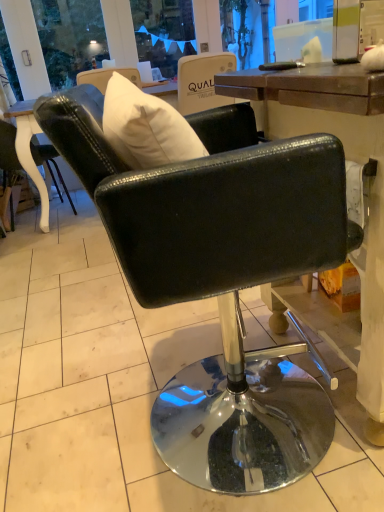
Question: From a real-world perspective, is glossy black chair at center, which ranks as the second chair in back-to-front order, physically located above or below black leather chair at left, placed as the 2th chair when sorted from right to left?

Choices:
 (A) below
 (B) above

Answer: (B)

Question: Which is correct: glossy black chair at center, the first chair from the right, is inside black leather chair at left, placed as the 2th chair when sorted from right to left, or outside of it?

Choices:
 (A) outside
 (B) inside

Answer: (A)

Question: Is glossy black chair at center, which is counted as the 2th chair, starting from the left, bigger or smaller than black leather chair at left, placed as the 1th chair when sorted from left to right?

Choices:
 (A) small
 (B) big

Answer: (B)

Question: Choose the correct answer: Is black leather chair at left, placed as the 2th chair when sorted from right to left, inside glossy black chair at center, the first chair from the right, or outside it?

Choices:
 (A) inside
 (B) outside

Answer: (B)

Question: Is black leather chair at left, which ranks as the 1th chair in back-to-front order, taller or shorter than glossy black chair at center, which ranks as the second chair in back-to-front order?

Choices:
 (A) short
 (B) tall

Answer: (A)

Question: In terms of size, does black leather chair at left, which ranks as the 1th chair in back-to-front order, appear bigger or smaller than glossy black chair at center, the first chair positioned from the front?

Choices:
 (A) small
 (B) big

Answer: (A)

Question: From the image's perspective, relative to glossy black chair at center, the first chair from the right, is black leather chair at left, placed as the 2th chair when sorted from right to left, above or below?

Choices:
 (A) below
 (B) above

Answer: (B)